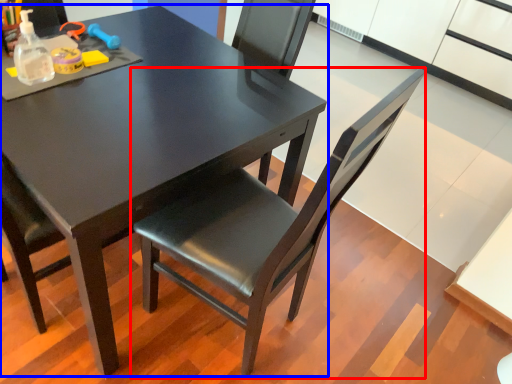
Question: Which object appears farthest to the camera in this image, chair (highlighted by a red box) or table (highlighted by a blue box)?

Choices:
 (A) chair
 (B) table

Answer: (B)